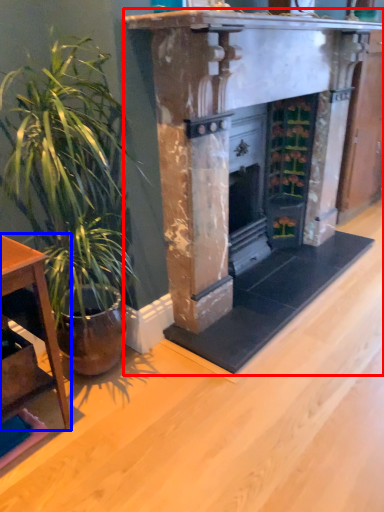
Question: Which of the following is the farthest to the observer, fireplace (highlighted by a red box) or table (highlighted by a blue box)?

Choices:
 (A) fireplace
 (B) table

Answer: (A)